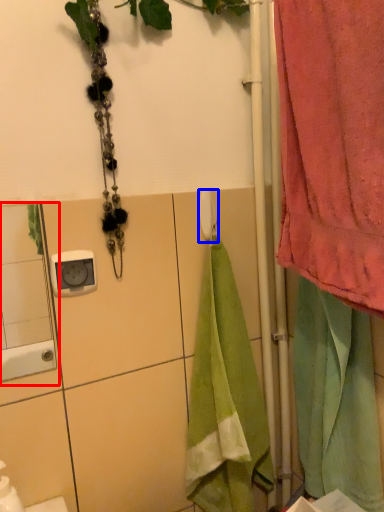
Question: Which point is closer to the camera, mirror (highlighted by a red box) or towel bar (highlighted by a blue box)?

Choices:
 (A) mirror
 (B) towel bar

Answer: (A)